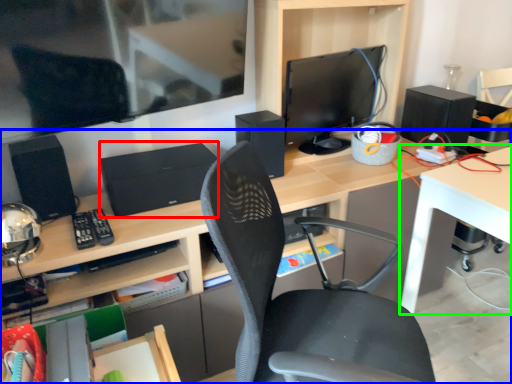
Question: Which is farther away from computer (highlighted by a red box)? desk (highlighted by a blue box) or table (highlighted by a green box)?

Choices:
 (A) desk
 (B) table

Answer: (B)